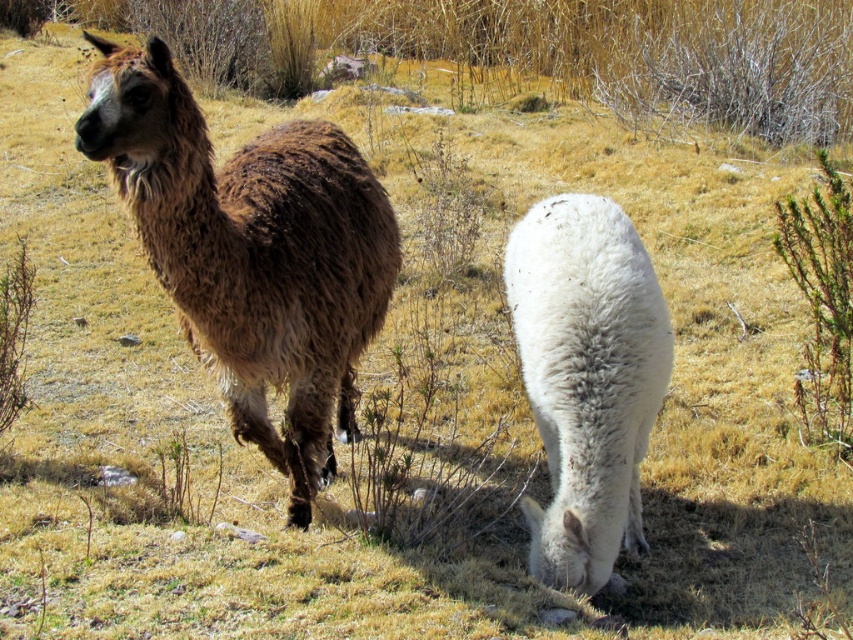
Question: Does brown woolly alpaca at left have a greater width compared to white woolen llama at center?

Choices:
 (A) yes
 (B) no

Answer: (A)

Question: Among these objects, which one is nearest to the camera?

Choices:
 (A) white woolen llama at center
 (B) brown woolly alpaca at left

Answer: (B)

Question: Is brown woolly alpaca at left further to camera compared to white woolen llama at center?

Choices:
 (A) no
 (B) yes

Answer: (A)

Question: Where is brown woolly alpaca at left located in relation to white woolen llama at center in the image?

Choices:
 (A) below
 (B) above

Answer: (B)

Question: Which point appears farthest from the camera in this image?

Choices:
 (A) (306, 164)
 (B) (521, 220)

Answer: (B)

Question: Which object is closer to the camera taking this photo?

Choices:
 (A) brown woolly alpaca at left
 (B) white woolen llama at center

Answer: (A)